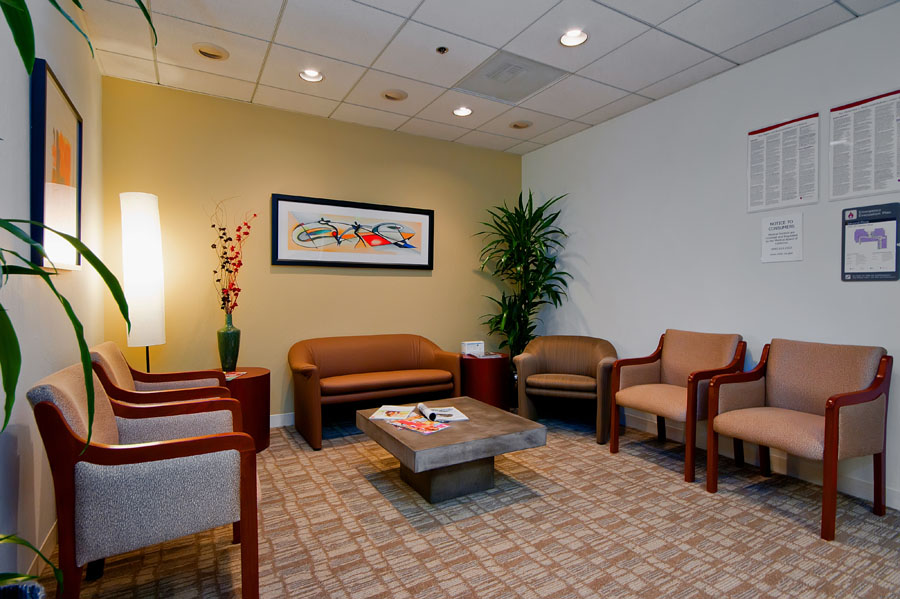
In order to click on seat in this screenshot , I will do `click(783, 423)`.